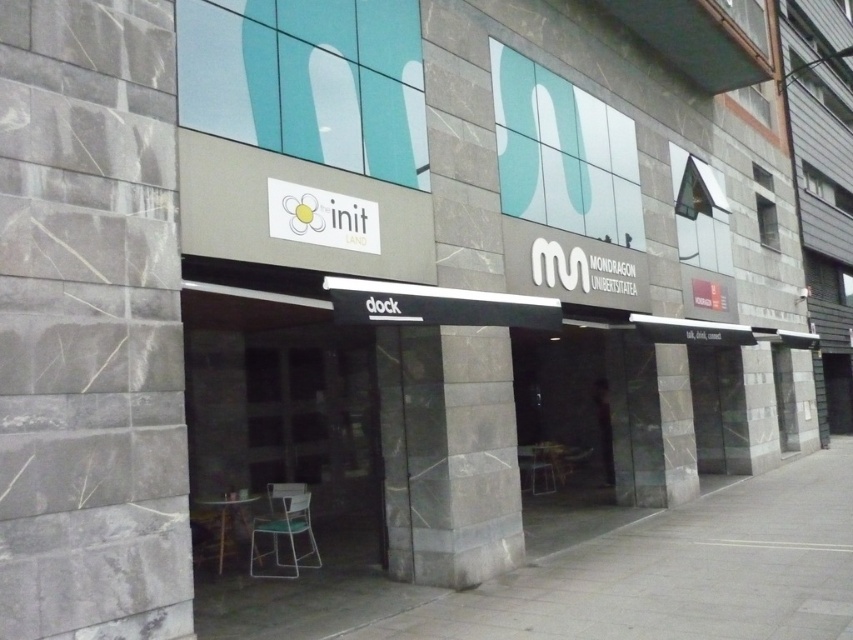
Does gray concrete pavement at lower center have a lesser width compared to metallic green chair at lower center?

Incorrect, gray concrete pavement at lower center's width is not less than metallic green chair at lower center's.

Is gray concrete pavement at lower center positioned behind metallic green chair at lower center?

No, it is in front of metallic green chair at lower center.

Is point (643, 547) behind point (271, 536)?

No, (643, 547) is in front of (271, 536).

Identify the location of gray concrete pavement at lower center. Image resolution: width=853 pixels, height=640 pixels. (677, 572).

Between gray concrete pavement at lower center and matte black door at center, which one has less height?

gray concrete pavement at lower center

Where is `gray concrete pavement at lower center`? This screenshot has height=640, width=853. gray concrete pavement at lower center is located at coordinates (x=677, y=572).

Locate an element on the screen. gray concrete pavement at lower center is located at coordinates (677, 572).

In the scene shown: Between metallic green chair at lower center and matte plastic chair at center, which one is positioned lower?

matte plastic chair at center is below.

Is metallic green chair at lower center below matte plastic chair at center?

No.

Is point (281, 560) positioned after point (547, 452)?

No, (281, 560) is closer to viewer.

Where is `metallic green chair at lower center`? The image size is (853, 640). metallic green chair at lower center is located at coordinates (283, 531).